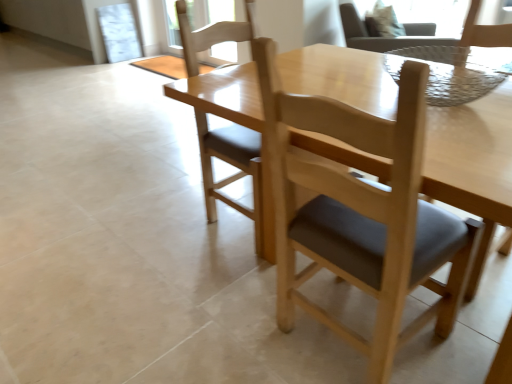
Question: Is light brown wood chair at center, which is counted as the 3th chair, starting from the top, shorter than light brown wood chair at center, which is the third chair in right-to-left order?

Choices:
 (A) yes
 (B) no

Answer: (A)

Question: Is light brown wood chair at center, which ranks as the fourth chair in right-to-left order, touching light brown wood chair at center, which is the 1th chair in bottom-to-top order?

Choices:
 (A) yes
 (B) no

Answer: (B)

Question: From a real-world perspective, does light brown wood chair at center, which is the 3th chair from back to front, stand above light brown wood chair at center, placed as the first chair when sorted from front to back?

Choices:
 (A) yes
 (B) no

Answer: (B)

Question: From the image's perspective, is light brown wood chair at center, the 2th chair in the bottom-to-top sequence, on top of light brown wood chair at center, placed as the fourth chair when sorted from top to bottom?

Choices:
 (A) no
 (B) yes

Answer: (B)

Question: Is light brown wood chair at center, which is counted as the 3th chair, starting from the top, closer to the viewer compared to light brown wood chair at center, the fourth chair from the back?

Choices:
 (A) yes
 (B) no

Answer: (B)

Question: Does point (470, 11) appear closer or farther from the camera than point (247, 34)?

Choices:
 (A) farther
 (B) closer

Answer: (B)

Question: In the image, is light brown wood chair at upper right, which is the 4th chair from bottom to top, positioned in front of or behind light brown wood chair at center, which ranks as the fourth chair in right-to-left order?

Choices:
 (A) front
 (B) behind

Answer: (B)

Question: From a real-world perspective, is light brown wood chair at upper right, which is the 4th chair from bottom to top, above or below light brown wood chair at center, which is the 3th chair from back to front?

Choices:
 (A) above
 (B) below

Answer: (B)

Question: Considering the positions of light brown wood chair at upper right, which is the 4th chair from bottom to top, and light brown wood chair at center, which ranks as the fourth chair in right-to-left order, in the image, is light brown wood chair at upper right, which is the 4th chair from bottom to top, taller or shorter than light brown wood chair at center, which ranks as the fourth chair in right-to-left order,?

Choices:
 (A) short
 (B) tall

Answer: (A)

Question: From a real-world perspective, is light brown wood chair at upper right, the first chair from the right, above or below light brown wood chair at upper right, the 2th chair positioned from the back?

Choices:
 (A) below
 (B) above

Answer: (A)

Question: Considering the positions of point (477, 39) and point (340, 16), is point (477, 39) closer or farther from the camera than point (340, 16)?

Choices:
 (A) farther
 (B) closer

Answer: (B)

Question: Which is correct: light brown wood chair at upper right, placed as the 4th chair when sorted from front to back, is inside light brown wood chair at upper right, the second chair viewed from the top, or outside of it?

Choices:
 (A) outside
 (B) inside

Answer: (A)

Question: Is light brown wood chair at upper right, placed as the 4th chair when sorted from front to back, bigger or smaller than light brown wood chair at upper right, marked as the 3th chair in a front-to-back arrangement?

Choices:
 (A) big
 (B) small

Answer: (A)

Question: Is light brown wood chair at center, which ranks as the fourth chair in right-to-left order, inside or outside of light brown wood chair at upper right, the 3th chair when ordered from left to right?

Choices:
 (A) inside
 (B) outside

Answer: (B)

Question: Based on their positions, is light brown wood chair at center, which is counted as the 1th chair, starting from the left, located to the left or right of light brown wood chair at upper right, the 2th chair positioned from the back?

Choices:
 (A) left
 (B) right

Answer: (A)